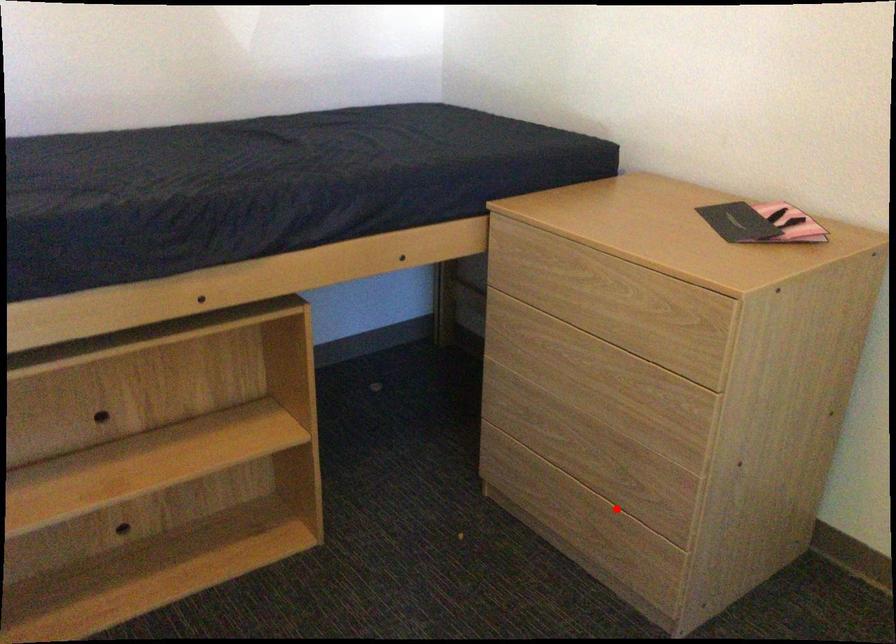
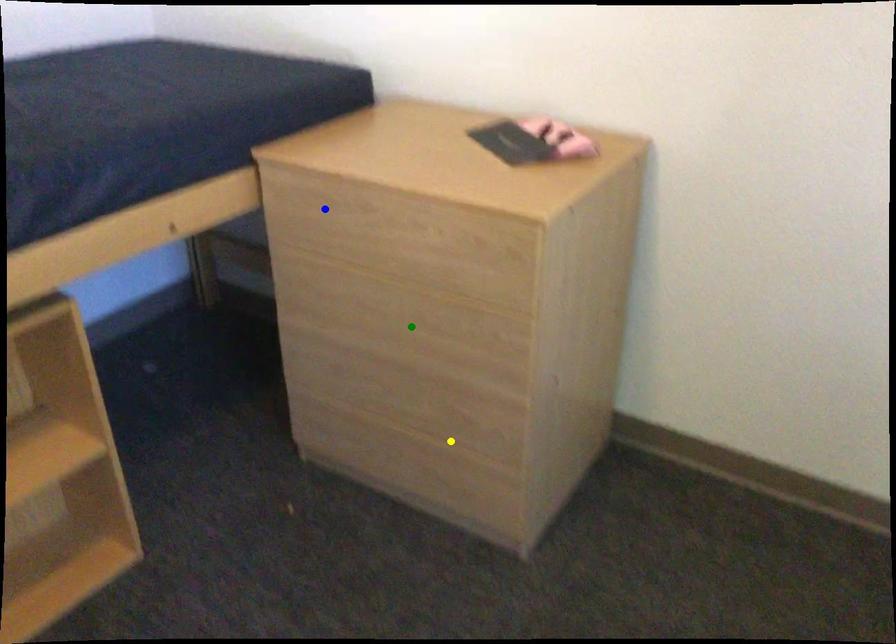
Question: I am providing you with two images of the same scene from different viewpoints. A red point is marked on the first image. You are given multiple points on the second image. Which spot in image 2 lines up with the point in image 1?

Choices:
 (A) blue point
 (B) green point
 (C) yellow point

Answer: (C)